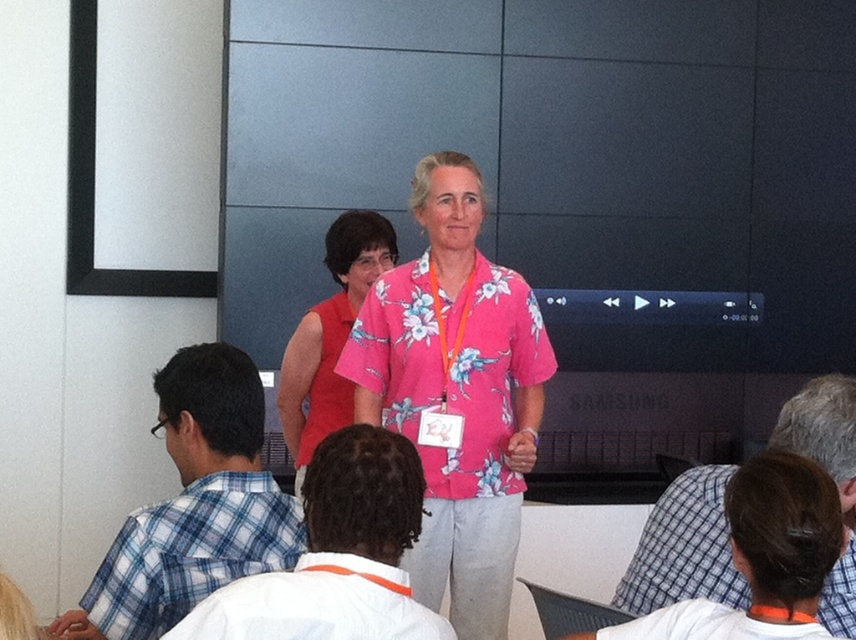
Question: Which point is closer to the camera taking this photo?

Choices:
 (A) (709, 493)
 (B) (417, 449)

Answer: (A)

Question: Among these points, which one is farthest from the camera?

Choices:
 (A) (226, 353)
 (B) (845, 449)
 (C) (314, 348)

Answer: (C)

Question: Does floral print shirt at center appear on the left side of pink floral shirt at center?

Choices:
 (A) no
 (B) yes

Answer: (A)

Question: Is floral print shirt at center above white cotton shirt at center?

Choices:
 (A) yes
 (B) no

Answer: (A)

Question: Is floral print shirt at center bigger than white checkered shirt at lower right?

Choices:
 (A) yes
 (B) no

Answer: (A)

Question: Which object appears farthest from the camera in this image?

Choices:
 (A) white checkered shirt at lower right
 (B) white cotton shirt at center
 (C) pink floral shirt at center
 (D) blue plaid shirt at left

Answer: (C)